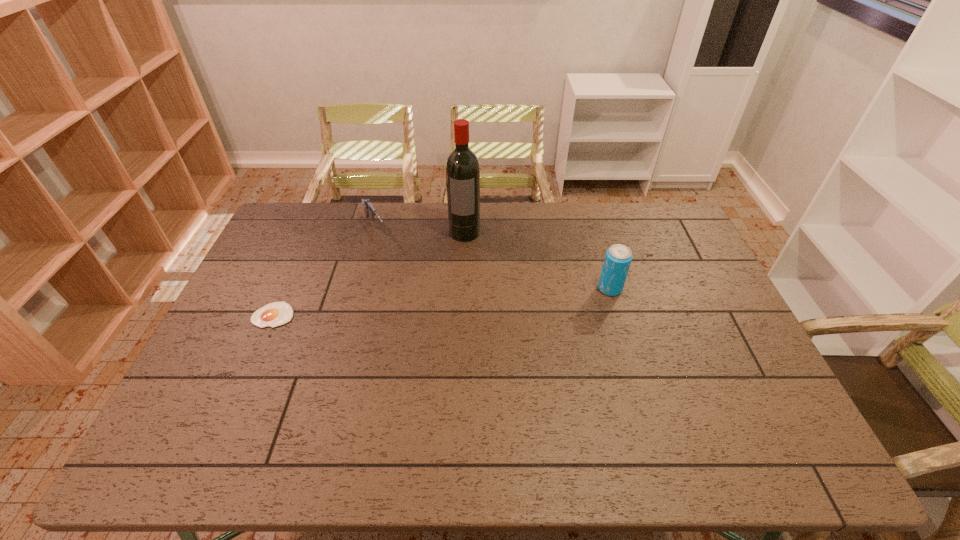
I want to click on free space between the egg yolk and the soda can, so click(x=442, y=302).

Identify the location of free space that is in between the nearest object and the third shortest object. (442, 302).

Identify the location of free space between the third object from right to left and the tallest object. (420, 231).

This screenshot has height=540, width=960. Find the location of `free space that is in between the third object from left to right and the leftmost object`. free space that is in between the third object from left to right and the leftmost object is located at coordinates (369, 274).

Where is `vacant area that lies between the third object from left to right and the egg yolk`? This screenshot has height=540, width=960. vacant area that lies between the third object from left to right and the egg yolk is located at coordinates (369, 274).

Identify which object is the third closest to the third object from right to left. Please provide its 2D coordinates. Your answer should be formatted as a tuple, i.e. [(x, y)], where the tuple contains the x and y coordinates of a point satisfying the conditions above.

[(618, 258)]

At what (x,y) coordinates should I click in order to perform the action: click on object that can be found as the third closest to the tallest object. Please return your answer as a coordinate pair (x, y). Looking at the image, I should click on (274, 314).

Where is `free location that satisfies the following two spatial constraints: 1. on the back side of the egg yolk; 2. on the left side of the second nearest object`? Image resolution: width=960 pixels, height=540 pixels. free location that satisfies the following two spatial constraints: 1. on the back side of the egg yolk; 2. on the left side of the second nearest object is located at coordinates (285, 288).